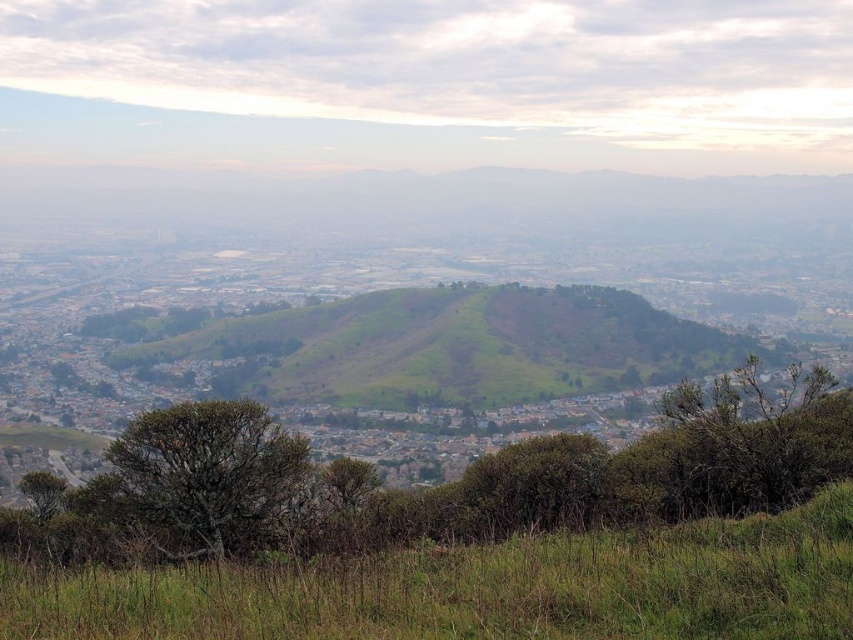
From the picture: Between green leafy shrub at center and green grassy at lower center, which one appears on the left side from the viewer's perspective?

Positioned to the left is green leafy shrub at center.

Is green leafy shrub at center to the right of green grassy at lower center from the viewer's perspective?

Incorrect, green leafy shrub at center is not on the right side of green grassy at lower center.

Which is behind, point (735, 451) or point (200, 570)?

The point (735, 451) is behind.

Where is `green leafy shrub at center`? green leafy shrub at center is located at coordinates (433, 486).

The image size is (853, 640). What do you see at coordinates (479, 588) in the screenshot?
I see `green grassy at lower center` at bounding box center [479, 588].

Between green grassy at lower center and green leafy tree at center, which one is positioned lower?

green leafy tree at center

Between point (125, 614) and point (158, 416), which one is positioned in front?

Point (125, 614) is in front.

At what (x,y) coordinates should I click in order to perform the action: click on green grassy at lower center. Please return your answer as a coordinate pair (x, y). This screenshot has height=640, width=853. Looking at the image, I should click on (479, 588).

Which of these two, green leafy shrub at center or green leafy tree at center, stands taller?

green leafy shrub at center is taller.

Looking at this image, can you confirm if green leafy shrub at center is thinner than green leafy tree at center?

Incorrect, green leafy shrub at center's width is not less than green leafy tree at center's.

Measure the distance between point (373, 502) and camera.

Point (373, 502) and camera are 360.95 meters apart.

Where is `green leafy shrub at center`? The height and width of the screenshot is (640, 853). green leafy shrub at center is located at coordinates (433, 486).